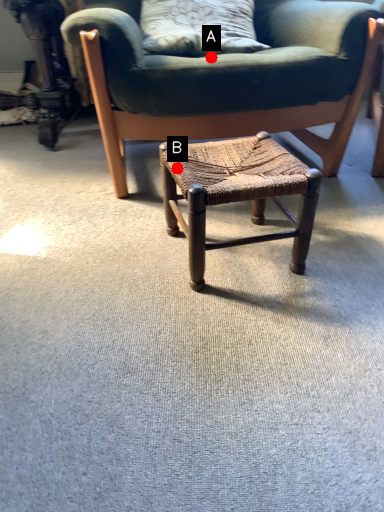
Question: Two points are circled on the image, labeled by A and B beside each circle. Which of the following is the farthest from the observer?

Choices:
 (A) A is further
 (B) B is further

Answer: (A)